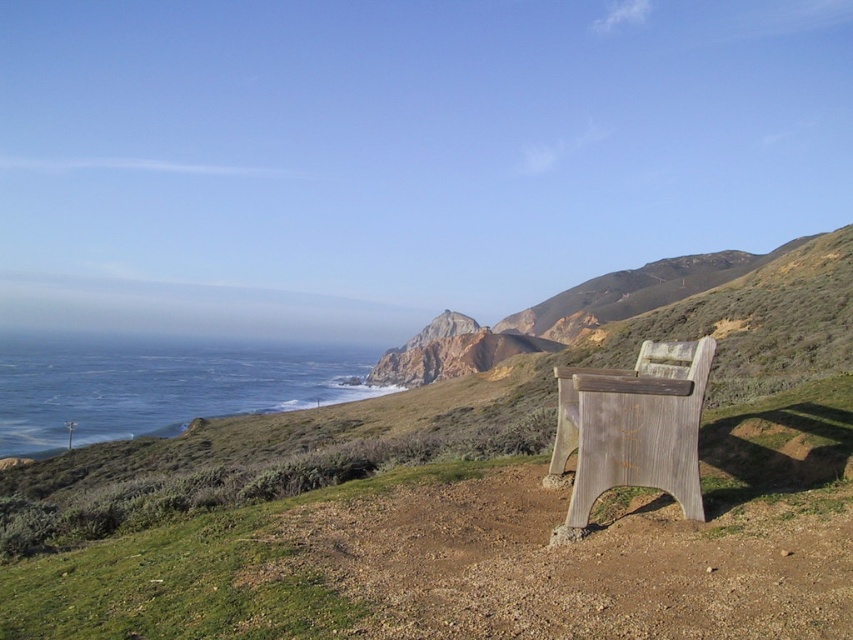
Question: In this image, where is green grassy at lower left located relative to weathered wood park bench at right?

Choices:
 (A) left
 (B) right

Answer: (B)

Question: Which point is closer to the camera?

Choices:
 (A) weathered wood park bench at right
 (B) blue water at lower left

Answer: (A)

Question: Does blue water at lower left have a larger size compared to weathered wood park bench at right?

Choices:
 (A) no
 (B) yes

Answer: (B)

Question: Which object is farther from the camera taking this photo?

Choices:
 (A) weathered wood park bench at right
 (B) green grassy at lower left
 (C) blue water at lower left

Answer: (C)

Question: Is green grassy at lower left closer to the viewer compared to weathered wood park bench at right?

Choices:
 (A) yes
 (B) no

Answer: (A)

Question: Estimate the real-world distances between objects in this image. Which object is closer to the green grassy at lower left?

Choices:
 (A) weathered wood park bench at right
 (B) blue water at lower left

Answer: (A)